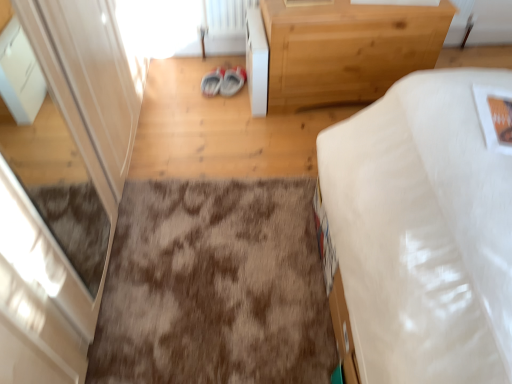
The width and height of the screenshot is (512, 384). Find the location of `vacant space that's between matte gray sneakers at center and brown shaggy rug at center`. vacant space that's between matte gray sneakers at center and brown shaggy rug at center is located at coordinates (210, 135).